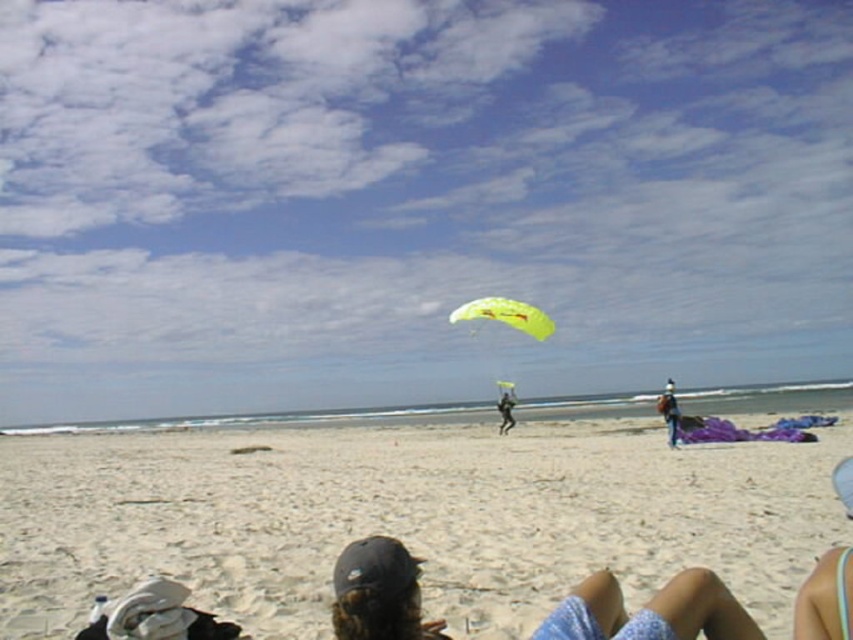
Question: Which of the following is the farthest from the observer?

Choices:
 (A) white sand at lower center
 (B) neon yellow fabric parachute at center

Answer: (B)

Question: Which object appears closest to the camera in this image?

Choices:
 (A) multicolored swimsuit at lower right
 (B) yellow fabric parachute at center
 (C) transparent yellow parachute at center
 (D) black matte cap at lower center

Answer: (D)

Question: Which object is closer to the camera taking this photo?

Choices:
 (A) blue denim jeans at lower right
 (B) black matte cap at lower center

Answer: (B)

Question: Does transparent yellow parachute at center lie in front of neon yellow fabric parachute at center?

Choices:
 (A) no
 (B) yes

Answer: (A)

Question: Is black matte cap at lower center closer to camera compared to yellow fabric parachute at center?

Choices:
 (A) no
 (B) yes

Answer: (B)

Question: Observing the image, what is the correct spatial positioning of white sand at lower center in reference to blue denim jeans at lower right?

Choices:
 (A) below
 (B) above

Answer: (A)